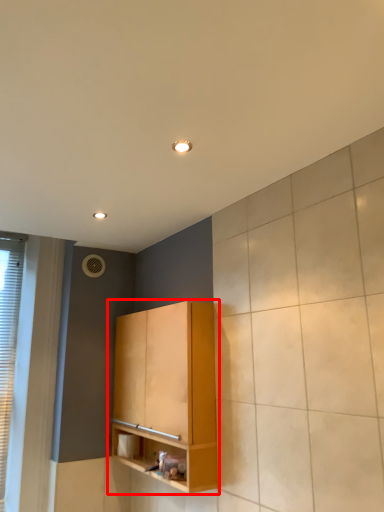
Question: Where is cabinetry (annotated by the red box) located in relation to window in the image?

Choices:
 (A) right
 (B) left

Answer: (A)